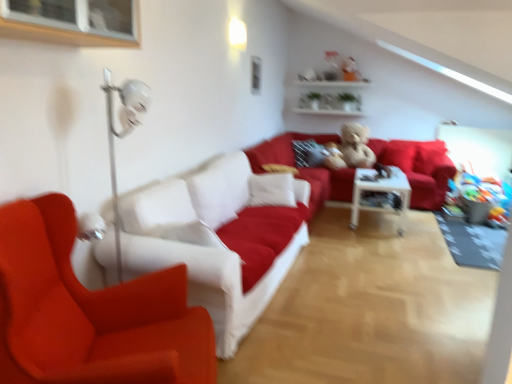
Identify the location of free space in front of white glossy table at center. Image resolution: width=512 pixels, height=384 pixels. [x=395, y=238].